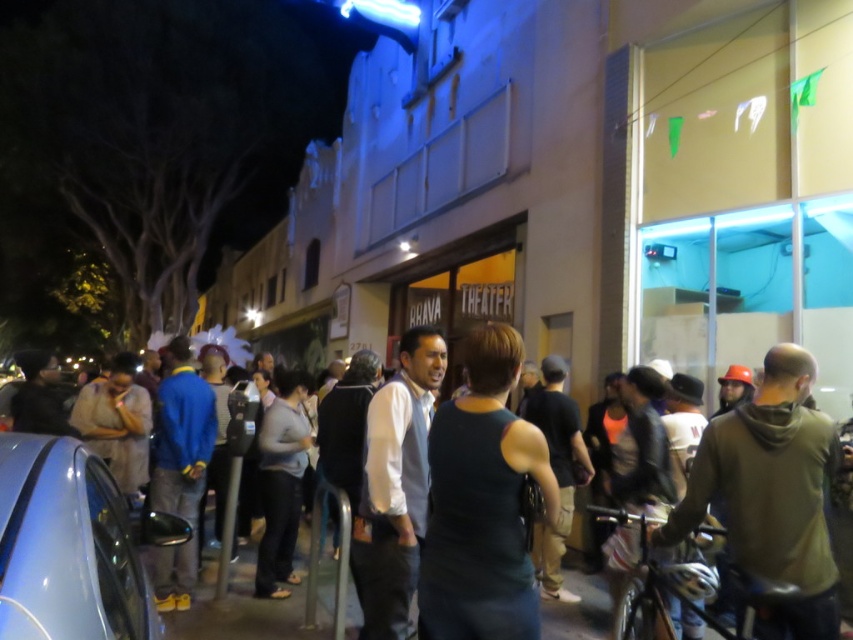
In the scene shown: Between metallic blue car at lower left and white shirt at center, which one is positioned higher?

metallic blue car at lower left is higher up.

Does metallic blue car at lower left appear under white shirt at center?

No, metallic blue car at lower left is not below white shirt at center.

Which is behind, point (99, 552) or point (392, 556)?

The point (392, 556) is more distant.

Find the location of a particular element. metallic blue car at lower left is located at coordinates (67, 547).

Is dark green tank top at center wider than green hoodie at center?

No.

Can you confirm if dark green tank top at center is positioned above green hoodie at center?

Correct, dark green tank top at center is located above green hoodie at center.

At what (x,y) coordinates should I click in order to perform the action: click on dark green tank top at center. Please return your answer as a coordinate pair (x, y). The image size is (853, 640). Looking at the image, I should click on (482, 502).

Does green hoodie at center have a lesser width compared to dark gray tank top at center?

Correct, green hoodie at center's width is less than dark gray tank top at center's.

Describe the element at coordinates (770, 493) in the screenshot. I see `green hoodie at center` at that location.

Who is more distant from viewer, (764, 492) or (270, 611)?

The point (270, 611) is more distant.

Locate an element on the screen. This screenshot has width=853, height=640. green hoodie at center is located at coordinates (770, 493).